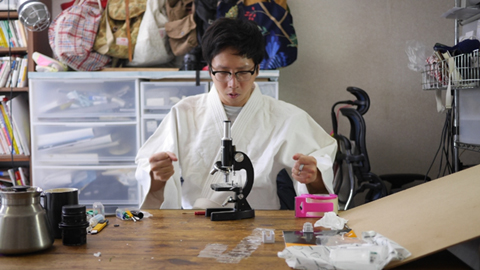
Identify the location of wood table. The height and width of the screenshot is (270, 480). (186, 226).